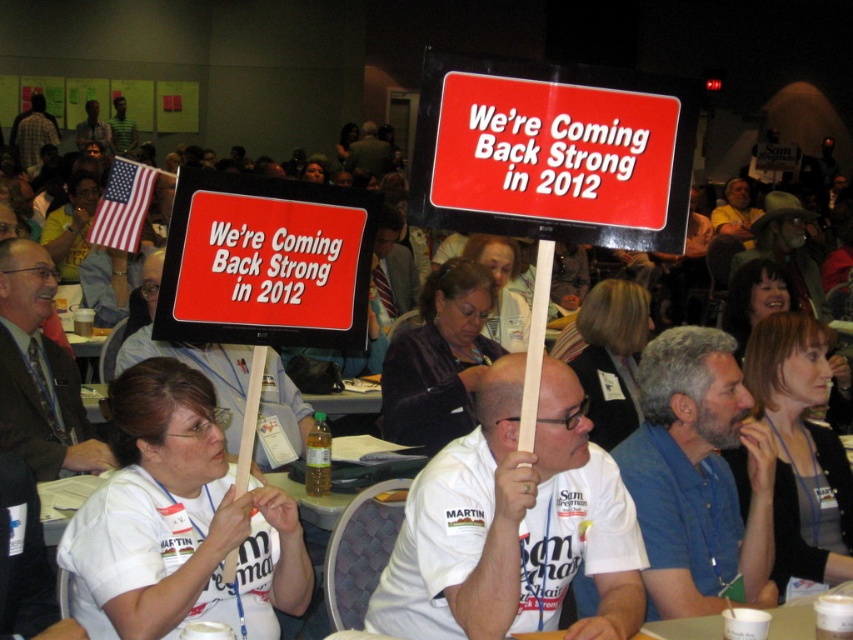
Between point (662, 611) and point (93, 472), which one is positioned behind?

Point (93, 472)

In the scene shown: Can you confirm if blue cotton shirt at center is positioned below dark brown suit at center?

Yes.

Who is more forward, (656, 410) or (12, 269)?

Point (656, 410)

Locate an element on the screen. The height and width of the screenshot is (640, 853). blue cotton shirt at center is located at coordinates (697, 476).

Does white cotton shirt at center have a lesser width compared to dark brown suit at center?

No.

Does white cotton shirt at center have a greater height compared to dark brown suit at center?

No, white cotton shirt at center is not taller than dark brown suit at center.

Does point (535, 564) lie behind point (19, 392)?

No, it is not.

Locate an element on the screen. This screenshot has width=853, height=640. white cotton shirt at center is located at coordinates (514, 525).

Who is positioned more to the right, white cotton shirt at center or blue cotton shirt at center?

From the viewer's perspective, blue cotton shirt at center appears more on the right side.

Can you confirm if white cotton shirt at center is thinner than blue cotton shirt at center?

Incorrect, white cotton shirt at center's width is not less than blue cotton shirt at center's.

Where is `white cotton shirt at center`? This screenshot has height=640, width=853. white cotton shirt at center is located at coordinates (514, 525).